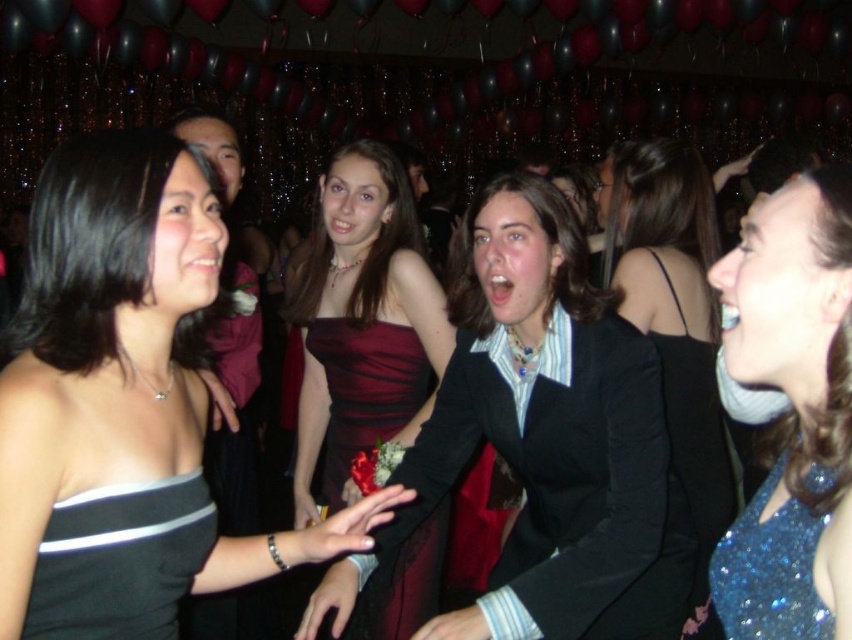
Looking at this image, you are organizing a charity event and need to arrange two dresses on a display table. The shiny burgundy dress at center and the black satin dress at center must be placed side by side. Given their sizes, which dress should you place on the left to ensure both fit comfortably on the table?

The shiny burgundy dress at center occupies less space than the black satin dress at center, so placing the smaller shiny burgundy dress at center on the left would allow both to fit comfortably on the table.

You are a photographer at the event and want to capture a photo of both the shiny burgundy dress at center and the woman in the black dress with horizontal white stripes on the left. The camera you are using has a maximum focus range of 2 meters. Can you fit both subjects in the frame without moving the camera?

Yes, since the distance between the shiny burgundy dress at center and the woman in the black dress with horizontal white stripes on the left is 1.92 meters, which is within the camera maximum focus range of 2 meters, so both subjects can be captured in the frame.

You are a photographer at the event and need to position the sparkly blue dress at upper right and the black satin dress at left in a group photo. Which dress should be placed closer to the camera to ensure both appear proportionally sized in the photo?

The sparkly blue dress at upper right should be placed closer to the camera since it is larger in size compared to the black satin dress at left, helping to balance their sizes in the photo.